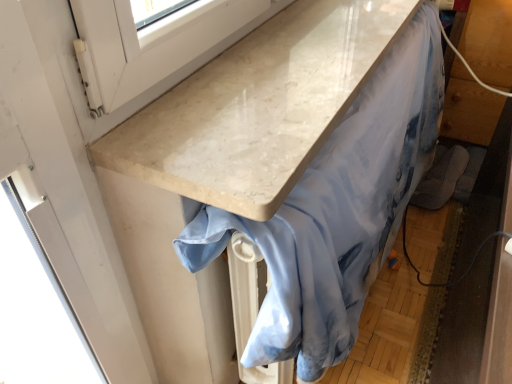
In order to face light blue satin fabric at center, should I rotate leftwards or rightwards?

Turn right approximately 12.957 degrees to face it.

Identify the location of light blue satin fabric at center. (339, 210).

What do you see at coordinates (339, 210) in the screenshot? I see `light blue satin fabric at center` at bounding box center [339, 210].

What do you see at coordinates (258, 106) in the screenshot? I see `white marble countertop at upper center` at bounding box center [258, 106].

The image size is (512, 384). I want to click on white marble countertop at upper center, so click(258, 106).

Measure the distance between point (265, 66) and camera.

They are 31.89 inches apart.

Locate an element on the screen. light blue satin fabric at center is located at coordinates (339, 210).

Does white marble countertop at upper center appear on the left side of light blue satin fabric at center?

Indeed, white marble countertop at upper center is positioned on the left side of light blue satin fabric at center.

Considering the relative positions of white marble countertop at upper center and light blue satin fabric at center in the image provided, is white marble countertop at upper center behind light blue satin fabric at center?

No, white marble countertop at upper center is in front of light blue satin fabric at center.

Considering the points (170, 167) and (411, 175), which point is in front, point (170, 167) or point (411, 175)?

The point (170, 167) is in front.

From the image's perspective, who appears lower, white marble countertop at upper center or light blue satin fabric at center?

light blue satin fabric at center, from the image's perspective.

From a real-world perspective, is white marble countertop at upper center under light blue satin fabric at center?

Incorrect, from a real-world perspective, white marble countertop at upper center is higher than light blue satin fabric at center.

Considering the sizes of objects white marble countertop at upper center and light blue satin fabric at center in the image provided, who is wider, white marble countertop at upper center or light blue satin fabric at center?

With larger width is white marble countertop at upper center.

Between white marble countertop at upper center and light blue satin fabric at center, which one has more height?

With more height is light blue satin fabric at center.

In terms of size, does white marble countertop at upper center appear bigger or smaller than light blue satin fabric at center?

white marble countertop at upper center is smaller than light blue satin fabric at center.

Can we say white marble countertop at upper center lies outside light blue satin fabric at center?

Yes, white marble countertop at upper center is outside of light blue satin fabric at center.

Looking at this image, is white marble countertop at upper center far from light blue satin fabric at center?

Actually, white marble countertop at upper center and light blue satin fabric at center are a little close together.

Is white marble countertop at upper center aimed at light blue satin fabric at center?

No, white marble countertop at upper center is not turned towards light blue satin fabric at center.

What's the angular difference between white marble countertop at upper center and light blue satin fabric at center's facing directions?

The angular difference between white marble countertop at upper center and light blue satin fabric at center is 1.36 degrees.

Where is `countertop in front of the light blue satin fabric at center`? The image size is (512, 384). countertop in front of the light blue satin fabric at center is located at coordinates (258, 106).

Does light blue satin fabric at center appear on the left side of white marble countertop at upper center?

In fact, light blue satin fabric at center is to the right of white marble countertop at upper center.

Considering the positions of objects light blue satin fabric at center and white marble countertop at upper center in the image provided, who is behind, light blue satin fabric at center or white marble countertop at upper center?

Positioned behind is light blue satin fabric at center.

Considering the points (365, 202) and (322, 5), which point is behind, point (365, 202) or point (322, 5)?

Point (322, 5)

From the image's perspective, is light blue satin fabric at center above or below white marble countertop at upper center?

From the image's perspective, light blue satin fabric at center appears below white marble countertop at upper center.

From a real-world perspective, does light blue satin fabric at center sit lower than white marble countertop at upper center?

Yes.

Considering the sizes of light blue satin fabric at center and white marble countertop at upper center in the image, is light blue satin fabric at center wider or thinner than white marble countertop at upper center?

light blue satin fabric at center is thinner than white marble countertop at upper center.

Who is taller, light blue satin fabric at center or white marble countertop at upper center?

Standing taller between the two is light blue satin fabric at center.

From the picture: Considering the relative sizes of light blue satin fabric at center and white marble countertop at upper center in the image provided, is light blue satin fabric at center bigger than white marble countertop at upper center?

Correct, light blue satin fabric at center is larger in size than white marble countertop at upper center.

Is light blue satin fabric at center surrounding white marble countertop at upper center?

Definitely not — white marble countertop at upper center is not inside light blue satin fabric at center.

Would you consider light blue satin fabric at center to be distant from white marble countertop at upper center?

light blue satin fabric at center is actually quite close to white marble countertop at upper center.

Could you tell me if light blue satin fabric at center is turned towards white marble countertop at upper center?

No, light blue satin fabric at center is not facing towards white marble countertop at upper center.

Identify the location of fabric below the white marble countertop at upper center (from a real-world perspective). The image size is (512, 384). (339, 210).

Locate an element on the screen. The height and width of the screenshot is (384, 512). countertop above the light blue satin fabric at center (from a real-world perspective) is located at coordinates (258, 106).

Identify the location of fabric on the right of white marble countertop at upper center. (339, 210).